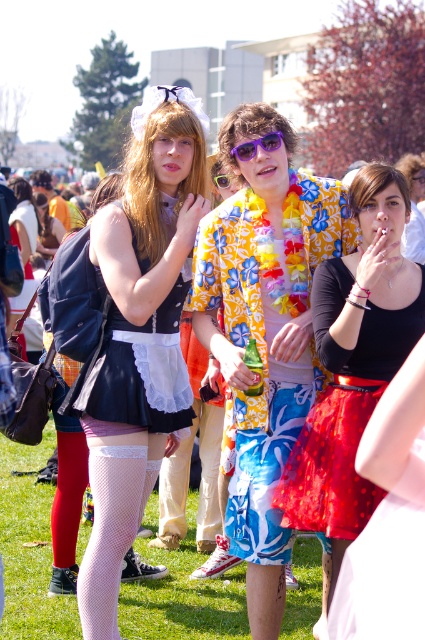
Between white lace dress at center and fishnet stocking at lower left, which one appears on the left side from the viewer's perspective?

From the viewer's perspective, white lace dress at center appears more on the left side.

Between point (132, 321) and point (414, 577), which one is positioned in front?

Point (414, 577)

You are a GUI agent. You are given a task and a screenshot of the screen. Output one action in this format:
    pyautogui.click(x=<x>, y=<y>)
    Task: Click on the white lace dress at center
    The width and height of the screenshot is (425, 640).
    Given the screenshot: What is the action you would take?
    pyautogui.click(x=139, y=333)

Can you confirm if green grass at lower center is positioned below shiny red tulle skirt at center?

Yes.

Who is more distant from viewer, (45, 573) or (357, 428)?

Point (45, 573)

Describe the element at coordinates (30, 548) in the screenshot. Image resolution: width=425 pixels, height=640 pixels. I see `green grass at lower center` at that location.

This screenshot has height=640, width=425. Find the location of `green grass at lower center`. green grass at lower center is located at coordinates (30, 548).

Does shiny red tulle skirt at center have a lesser height compared to purple plastic sunglasses at center?

No, shiny red tulle skirt at center is not shorter than purple plastic sunglasses at center.

Image resolution: width=425 pixels, height=640 pixels. I want to click on shiny red tulle skirt at center, so point(343,410).

Locate an element on the screen. The width and height of the screenshot is (425, 640). shiny red tulle skirt at center is located at coordinates (343, 410).